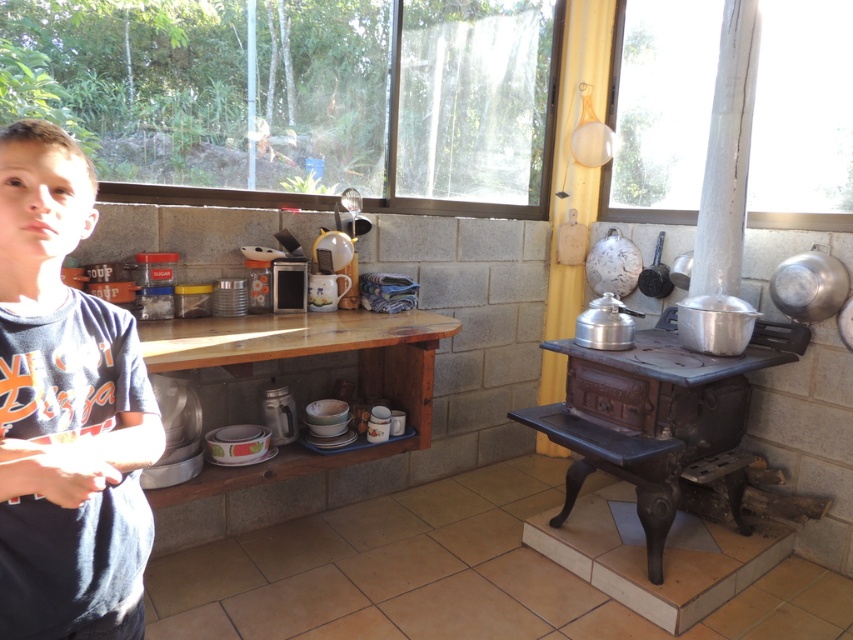
You are a delivery person trying to determine the best way to enter the kitchen through the door. You have a large package that is 1 meter wide. The entrance door is positioned near the rustic cast iron stove at right. Can the package fit through the door if the transparent glass window at upper center is directly above it?

The transparent glass window at upper center is wider than the rustic cast iron stove at right. Since the window is above the door, the door itself might be narrower than the window. However, the package is 1 meter wide, and without knowing the door width, we cannot confirm. The description only compares the window and stove widths, not the door. Thus, it is uncertain if the package will fit.